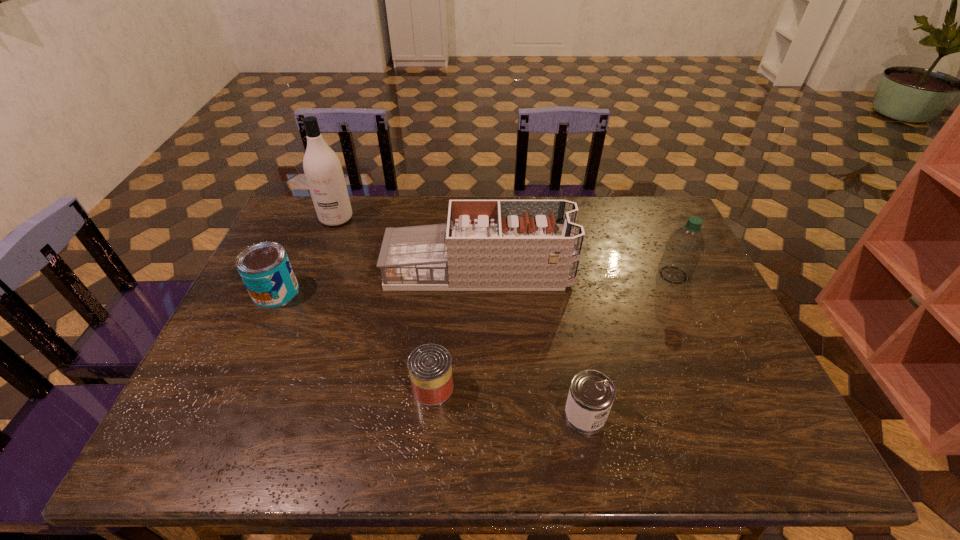
Locate an element on the screen. object that ranks as the third closest to the tallest can is located at coordinates (429, 365).

Identify the location of the fourth closest object to the second can from right to left. The width and height of the screenshot is (960, 540). (323, 171).

Image resolution: width=960 pixels, height=540 pixels. In order to click on the closest can to the water bottle in this screenshot , I will do `click(591, 395)`.

Image resolution: width=960 pixels, height=540 pixels. I want to click on can that is the second closest to the rightmost can, so click(265, 269).

At what (x,y) coordinates should I click in order to perform the action: click on free space that satisfies the following two spatial constraints: 1. at the entrance of the dollhouse; 2. on the back side of the rightmost can. Please return your answer as a coordinate pair (x, y). The image size is (960, 540). Looking at the image, I should click on (478, 415).

Identify the location of vacant space that satisfies the following two spatial constraints: 1. on the front-facing side of the tallest object; 2. on the left side of the water bottle. The width and height of the screenshot is (960, 540). 314,275.

Where is `free spot that satisfies the following two spatial constraints: 1. on the back side of the tallest can; 2. on the right side of the water bottle`? The height and width of the screenshot is (540, 960). free spot that satisfies the following two spatial constraints: 1. on the back side of the tallest can; 2. on the right side of the water bottle is located at coordinates (284, 275).

I want to click on vacant space that satisfies the following two spatial constraints: 1. on the front-facing side of the farthest object; 2. on the left side of the water bottle, so click(x=314, y=275).

At what (x,y) coordinates should I click in order to perform the action: click on free spot that satisfies the following two spatial constraints: 1. on the front-facing side of the rightmost object; 2. on the right side of the farthest object. Please return your answer as a coordinate pair (x, y). Looking at the image, I should click on (314, 275).

Where is `free space that satisfies the following two spatial constraints: 1. on the front-facing side of the tallest object; 2. on the left side of the rightmost can`? Image resolution: width=960 pixels, height=540 pixels. free space that satisfies the following two spatial constraints: 1. on the front-facing side of the tallest object; 2. on the left side of the rightmost can is located at coordinates (259, 415).